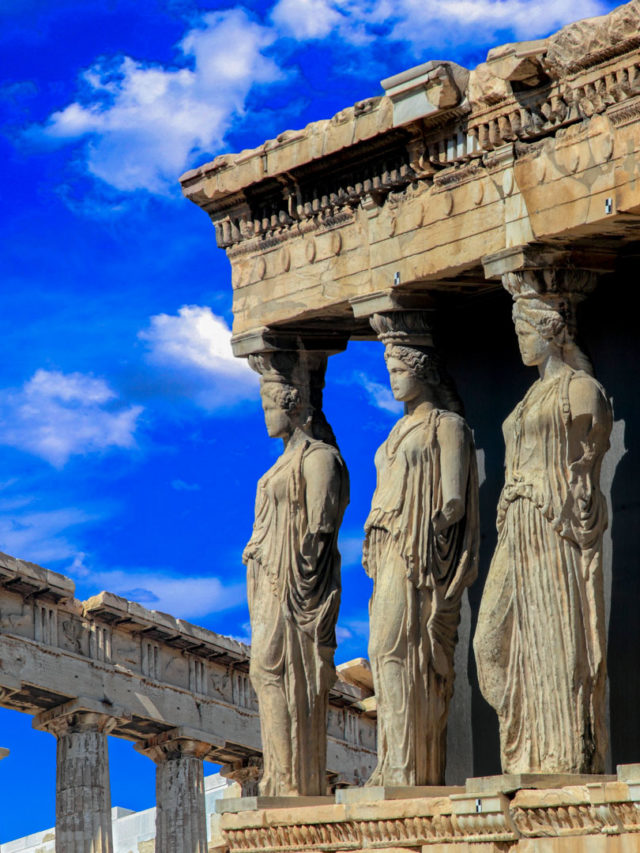
At what (x,y) coordinates should I click in order to perform the action: click on statue. Please return your answer as a coordinate pair (x, y). Looking at the image, I should click on (436, 467), (288, 519), (573, 450).